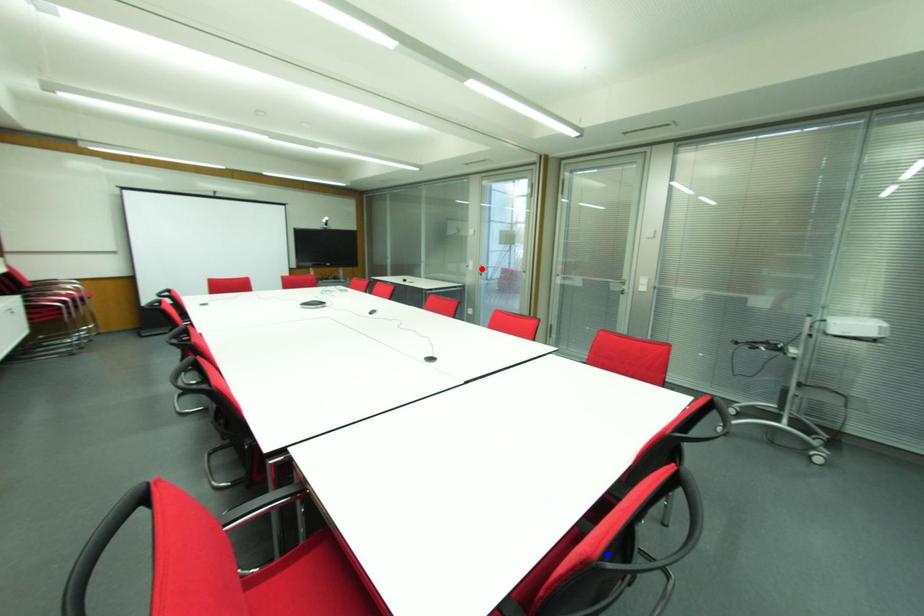
Question: In the image, two points are highlighted. Which point is nearer to the camera? Reply with the corresponding letter.

Choices:
 (A) blue point
 (B) red point

Answer: (A)